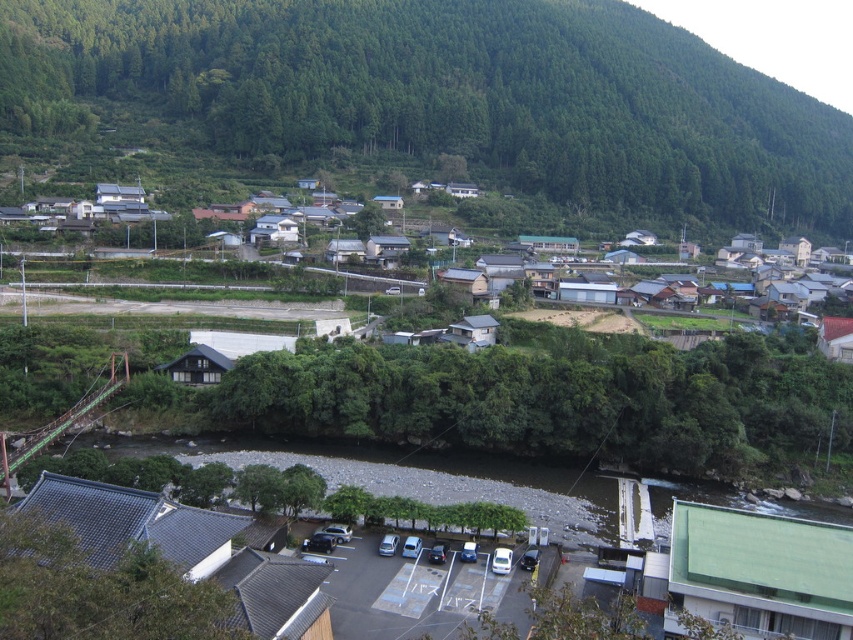
Looking at this image, which is more to the right, green forested mountain at upper center or brown gravel river at center?

green forested mountain at upper center

Does green forested mountain at upper center have a greater width compared to brown gravel river at center?

Yes.

Does point (103, 68) come farther from viewer compared to point (741, 499)?

Yes, it is.

Find the location of a particular element. The width and height of the screenshot is (853, 640). green forested mountain at upper center is located at coordinates click(x=447, y=97).

Which of these two, green forested mountain at upper center or white wooden houses at center, stands shorter?

white wooden houses at center is shorter.

Image resolution: width=853 pixels, height=640 pixels. Describe the element at coordinates (447, 97) in the screenshot. I see `green forested mountain at upper center` at that location.

The image size is (853, 640). I want to click on green forested mountain at upper center, so click(447, 97).

Is brown gravel river at center thinner than white wooden houses at center?

Yes, brown gravel river at center is thinner than white wooden houses at center.

Who is shorter, brown gravel river at center or white wooden houses at center?

Standing shorter between the two is brown gravel river at center.

Between point (573, 506) and point (509, 259), which one is positioned behind?

Positioned behind is point (509, 259).

I want to click on brown gravel river at center, so click(415, 476).